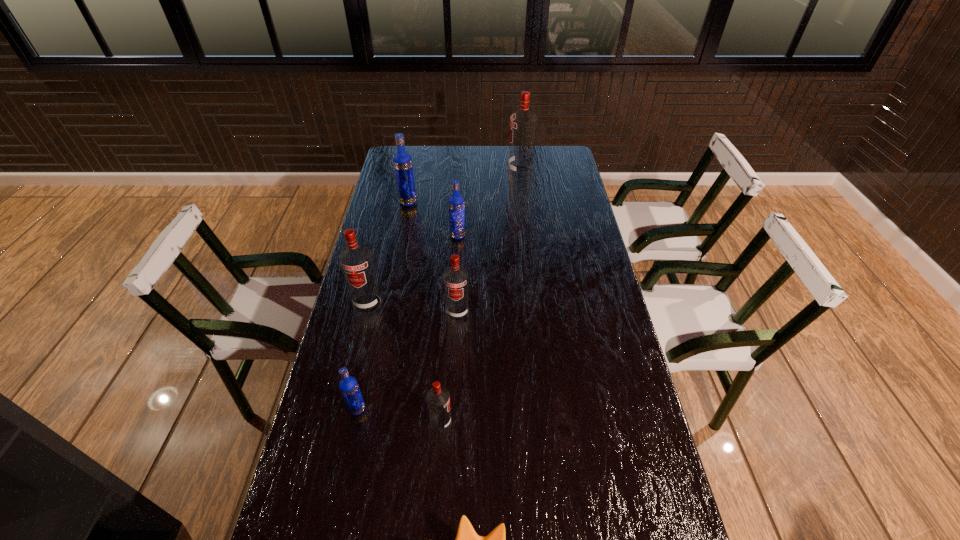
Find the location of `the tallest vodka`. the tallest vodka is located at coordinates (523, 123).

Locate an element on the screen. the farthest red vodka is located at coordinates (523, 123).

Find the location of `the biggest blue vodka`. the biggest blue vodka is located at coordinates (402, 161).

Locate an element on the screen. Image resolution: width=960 pixels, height=540 pixels. the second farthest object is located at coordinates (402, 161).

Find the location of a particular element. The height and width of the screenshot is (540, 960). the leftmost red vodka is located at coordinates (356, 261).

You are a GUI agent. You are given a task and a screenshot of the screen. Output one action in this format:
    pyautogui.click(x=<x>, y=<y>)
    Task: Click on the second farthest blue vodka
    This screenshot has width=960, height=540.
    Given the screenshot: What is the action you would take?
    pyautogui.click(x=456, y=204)

The height and width of the screenshot is (540, 960). I want to click on the third farthest vodka, so click(456, 204).

You are a GUI agent. You are given a task and a screenshot of the screen. Output one action in this format:
    pyautogui.click(x=<x>, y=<y>)
    Task: Click on the third biggest red vodka
    The height and width of the screenshot is (540, 960).
    Given the screenshot: What is the action you would take?
    pyautogui.click(x=455, y=277)

The width and height of the screenshot is (960, 540). What are the coordinates of `the smallest blue vodka` in the screenshot? It's located at (348, 385).

Locate an element on the screen. This screenshot has height=540, width=960. the smallest red vodka is located at coordinates (438, 399).